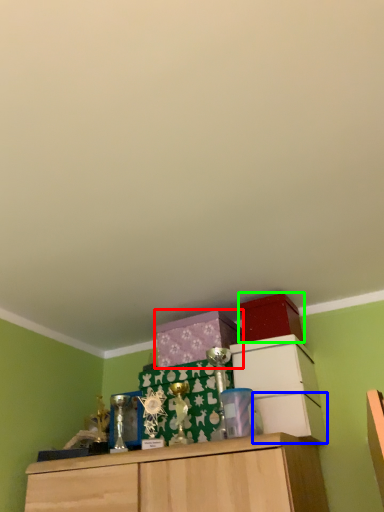
Question: Based on their relative distances, which object is nearer to cabinetry (highlighted by a red box)? Choose from drawer (highlighted by a blue box) and storage box (highlighted by a green box).

Choices:
 (A) drawer
 (B) storage box

Answer: (B)